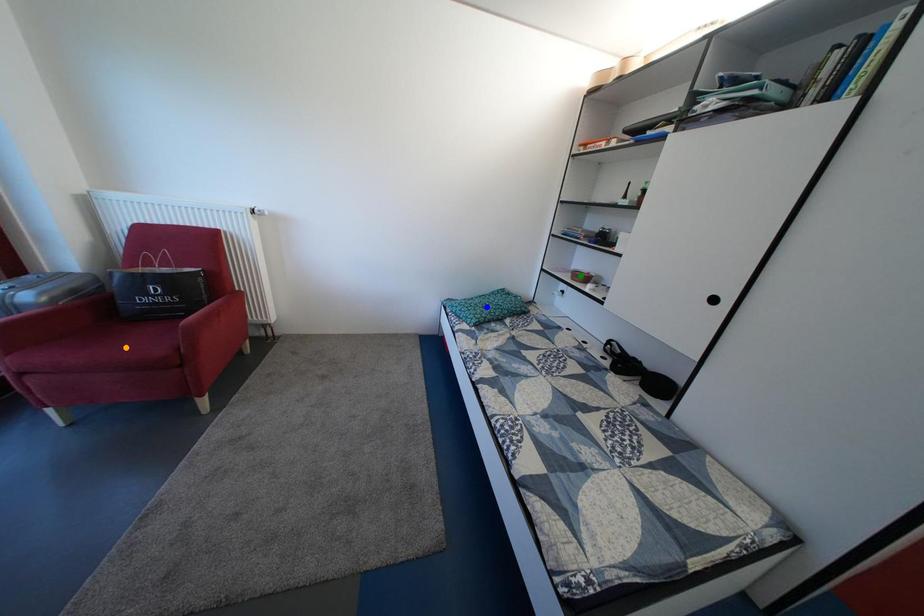
Order these from nearest to farthest:
1. green point
2. orange point
3. blue point

orange point < blue point < green point